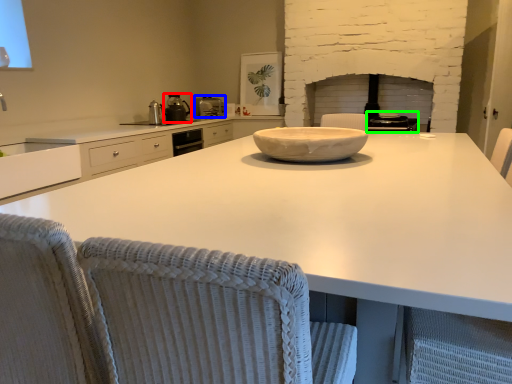
Question: Which object is the closest to the appliance (highlighted by a red box)? Choose among these: kitchen appliance (highlighted by a blue box) or appliance (highlighted by a green box).

Choices:
 (A) kitchen appliance
 (B) appliance

Answer: (A)